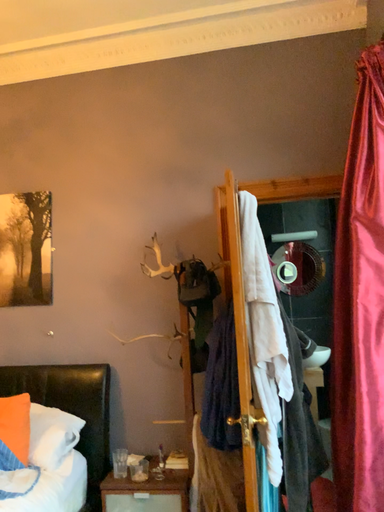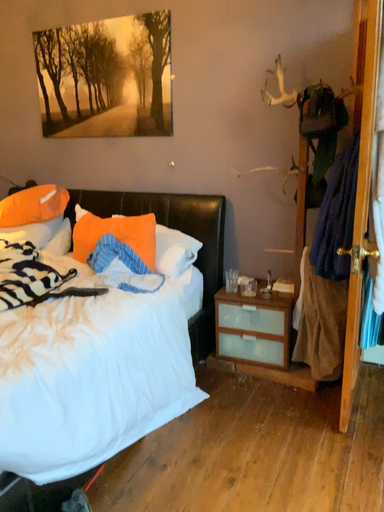
Question: How did the camera likely rotate when shooting the video?

Choices:
 (A) rotated downward
 (B) rotated upward

Answer: (A)